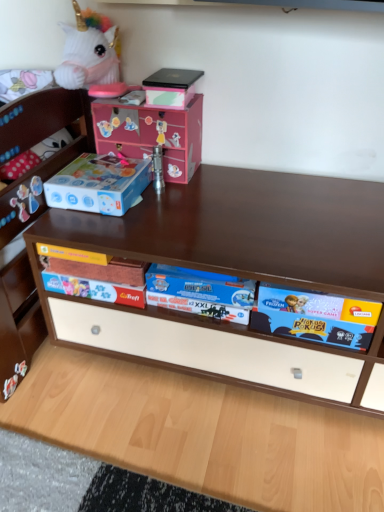
You are a GUI agent. You are given a task and a screenshot of the screen. Output one action in this format:
    pyautogui.click(x=<x>, y=<y>)
    Task: Click on the empty space that is ontop of blue cardboard storage box at left (from a real-world perspective)
    The height and width of the screenshot is (512, 384).
    Given the screenshot: What is the action you would take?
    pyautogui.click(x=96, y=168)